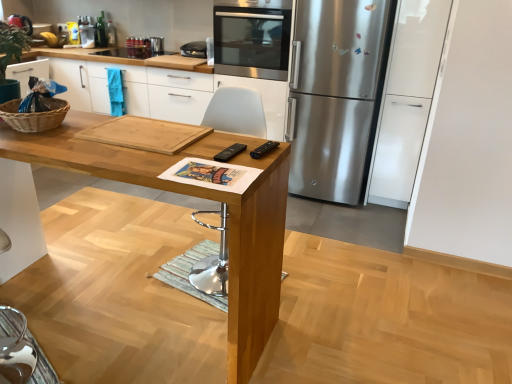
Where is `unoccupied area behind natural wood table at center`? unoccupied area behind natural wood table at center is located at coordinates (167, 240).